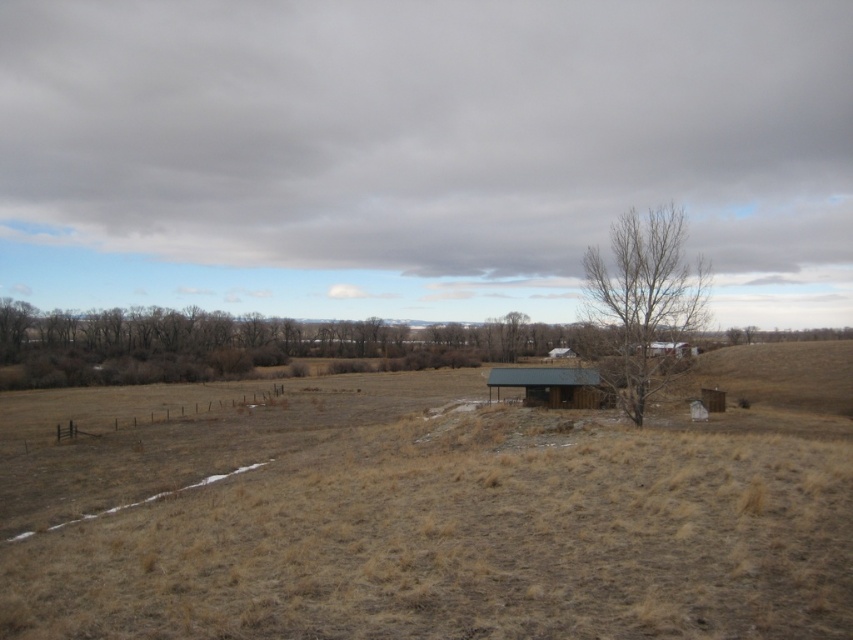
You are standing in the rural landscape and want to take a photo of the brown wooden cabin at center. However, the bare wood tree at center is blocking your view. Can you determine if the tree is taller than the cabin?

The bare wood tree at center is much taller than the brown wooden cabin at center, so it will block your view of the cabin.

You are standing in the rural landscape and want to walk from the dry grass at center to the brown wooden cabin at center. Which direction should you move to get closer to the cabin?

Since the dry grass at center is in front of the brown wooden cabin at center, you should move backward away from the dry grass at center to approach the cabin.